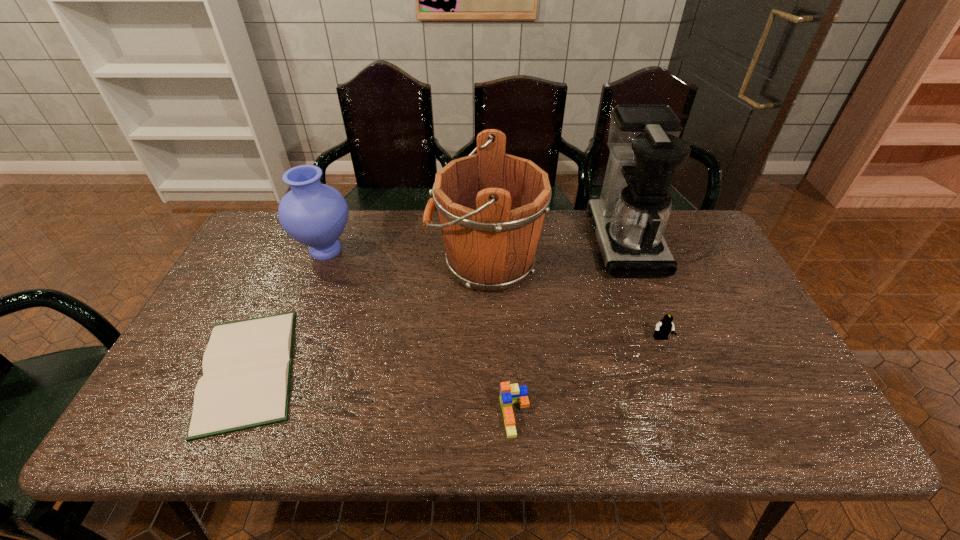
Locate an element on the screen. Image resolution: width=960 pixels, height=540 pixels. the second closest object to the left Lego is located at coordinates (665, 326).

Locate which object ranks second in proximity to the third shortest object. Please provide its 2D coordinates. Your answer should be formatted as a tuple, i.e. [(x, y)], where the tuple contains the x and y coordinates of a point satisfying the conditions above.

[(491, 205)]